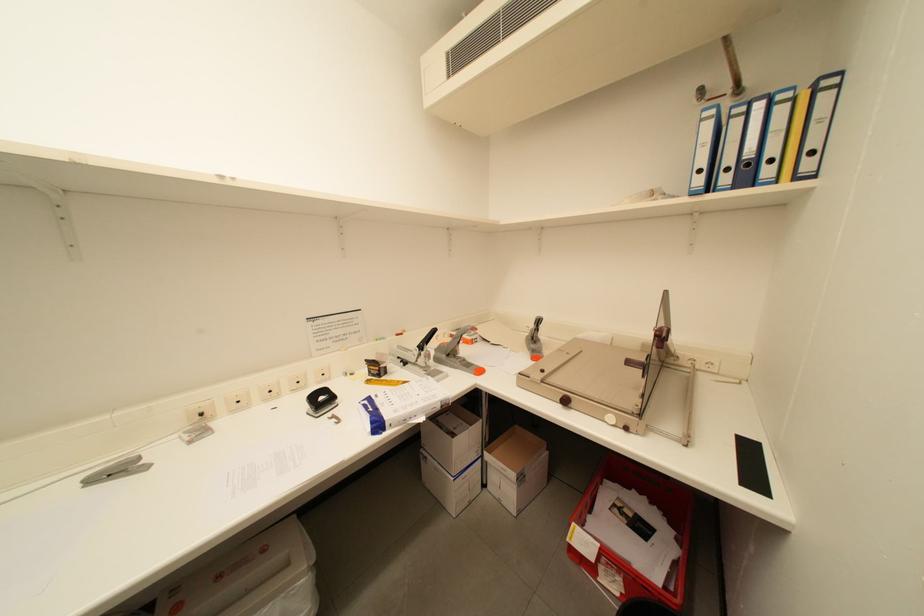
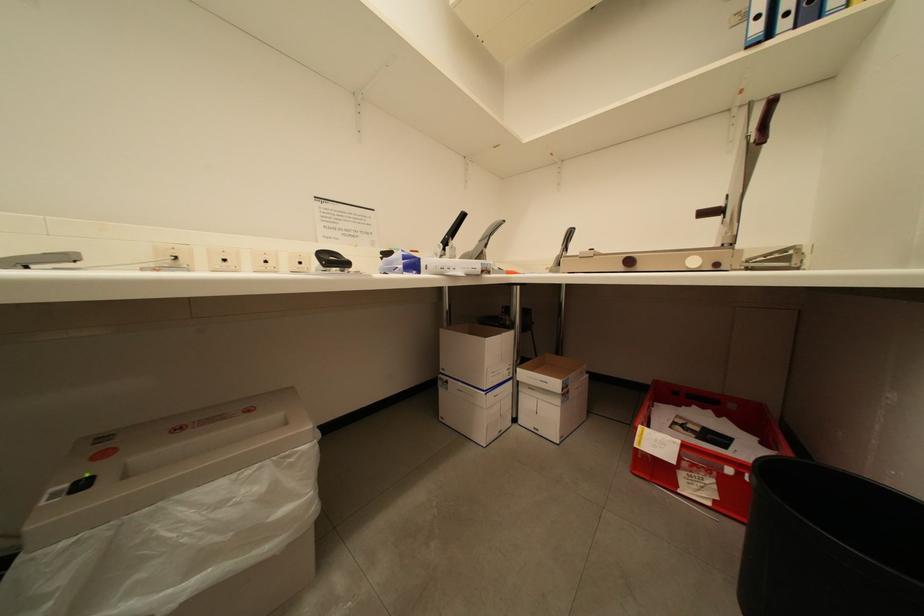
Consider the image. What movement of the cameraman would produce the second image?

The cameraman walked toward left, forward.